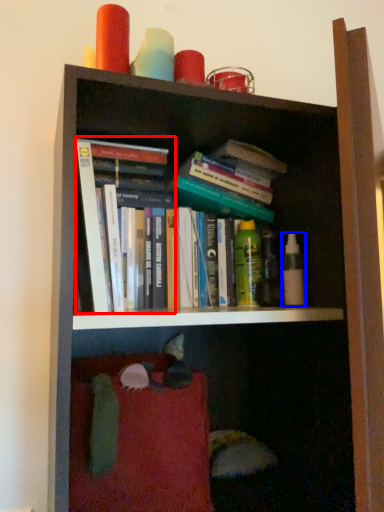
Question: Among these objects, which one is farthest to the camera, book (highlighted by a red box) or toiletry (highlighted by a blue box)?

Choices:
 (A) book
 (B) toiletry

Answer: (B)